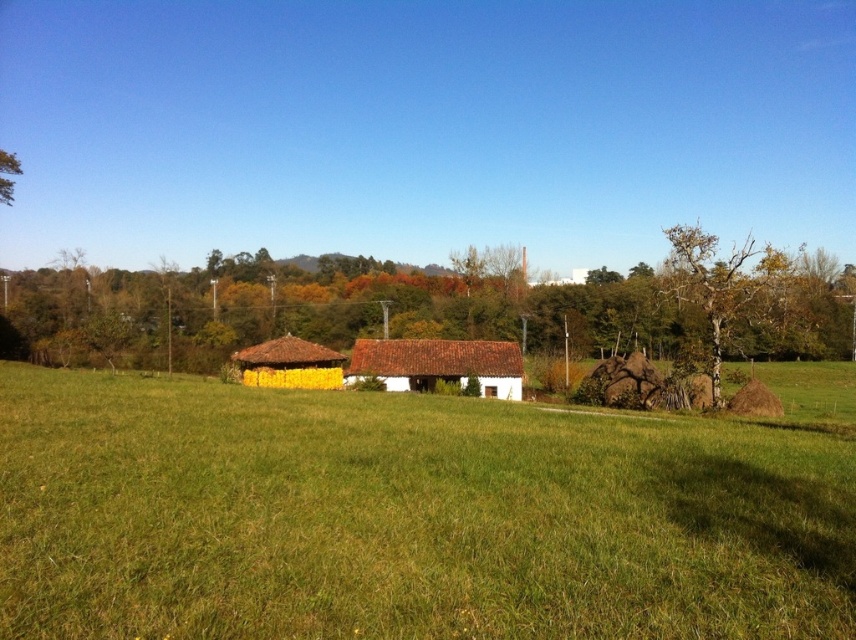
What is the 2D coordinate of the brown textured tree at right in the image?

The brown textured tree at right is located at the 2D coordinate point of (x=720, y=284).

You are planning to plant a new tree that requires at least 3 meters of clearance from any existing structures. Based on the scene, can you determine if the brown textured tree at right is tall enough to potentially interfere with the yellow straw hut at center if it grows taller?

The brown textured tree at right is taller than the yellow straw hut at center. If it continues to grow taller, it may interfere with the yellow straw hut at center due to its already greater height.